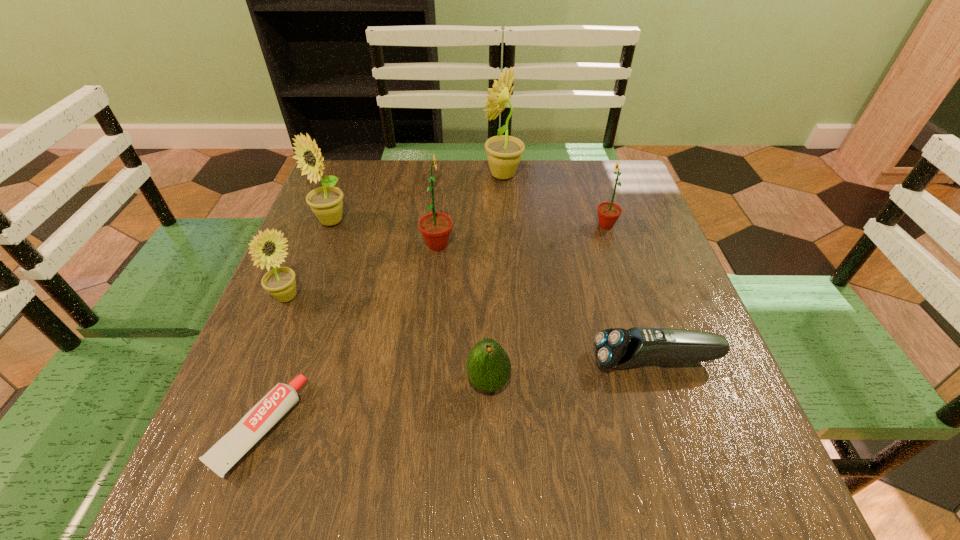
The height and width of the screenshot is (540, 960). I want to click on green avocado, so click(x=488, y=366).

You are a GUI agent. You are given a task and a screenshot of the screen. Output one action in this format:
    pyautogui.click(x=<x>, y=<y>)
    Task: Click on the electric shaver
    Image resolution: width=960 pixels, height=540 pixels.
    Given the screenshot: What is the action you would take?
    pyautogui.click(x=618, y=348)

Locate an element on the screen. The image size is (960, 540). the shortest object is located at coordinates [222, 456].

This screenshot has width=960, height=540. Identify the location of vacant area situated on the face of the biggest yellow sunflower. (396, 175).

This screenshot has height=540, width=960. Identify the location of vacant area located on the face of the biggest yellow sunflower. (378, 175).

Where is `vacant space located 0.170m on the face of the biggest yellow sunflower`? vacant space located 0.170m on the face of the biggest yellow sunflower is located at coordinates (423, 175).

This screenshot has width=960, height=540. What are the coordinates of `vacant space positioned on the face of the fourth farthest object` in the screenshot? It's located at (539, 245).

The width and height of the screenshot is (960, 540). I want to click on free space located 0.050m on the face of the second nearest yellow sunflower, so click(x=322, y=246).

The image size is (960, 540). I want to click on free spot located on the face of the nearest sunflower, so click(x=436, y=298).

Locate an element on the screen. The width and height of the screenshot is (960, 540). vacant position located 0.300m on the face of the right green sunflower is located at coordinates (473, 225).